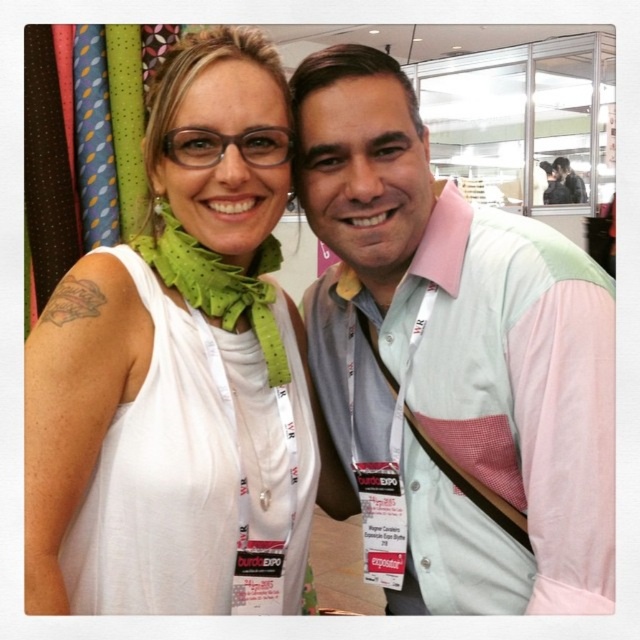
Between point (428, 168) and point (51, 348), which one is positioned in front?

Point (51, 348) is in front.

Does pink fabric vest at center appear on the left side of white fabric at center?

Incorrect, pink fabric vest at center is not on the left side of white fabric at center.

Find the location of a particular element. The height and width of the screenshot is (640, 640). pink fabric vest at center is located at coordinates (458, 356).

Is white fabric at center taller than green polka dot fabric scarf at upper left?

Yes, white fabric at center is taller than green polka dot fabric scarf at upper left.

Where is `white fabric at center`? Image resolution: width=640 pixels, height=640 pixels. white fabric at center is located at coordinates (177, 355).

Where is `white fabric at center`? This screenshot has height=640, width=640. white fabric at center is located at coordinates (177, 355).

Which is behind, point (433, 362) or point (211, 262)?

The point (433, 362) is more distant.

Is pink fabric vest at center bigger than green polka dot fabric scarf at upper left?

Indeed, pink fabric vest at center has a larger size compared to green polka dot fabric scarf at upper left.

Is point (538, 451) less distant than point (160, 220)?

Yes, point (538, 451) is in front of point (160, 220).

Locate an element on the screen. This screenshot has width=640, height=640. pink fabric vest at center is located at coordinates (458, 356).